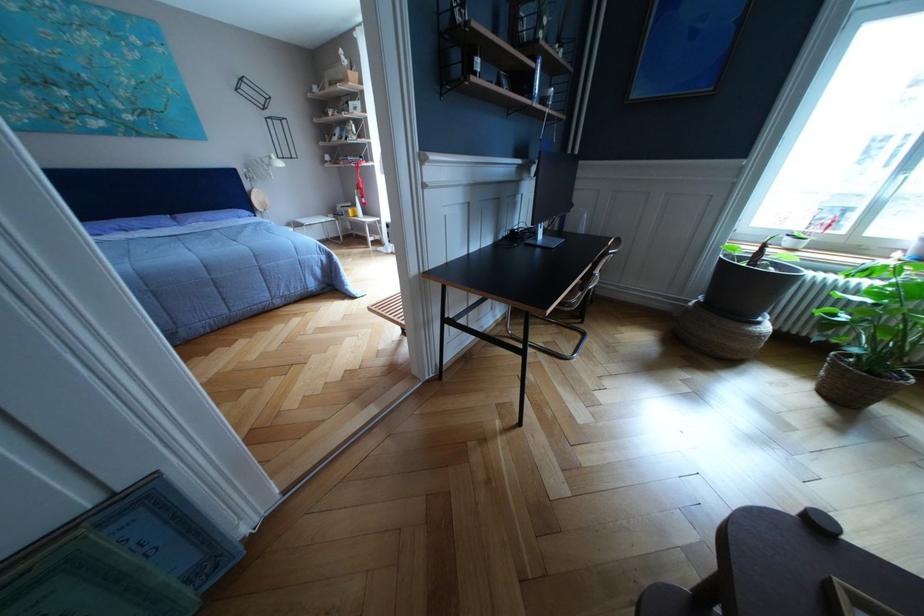
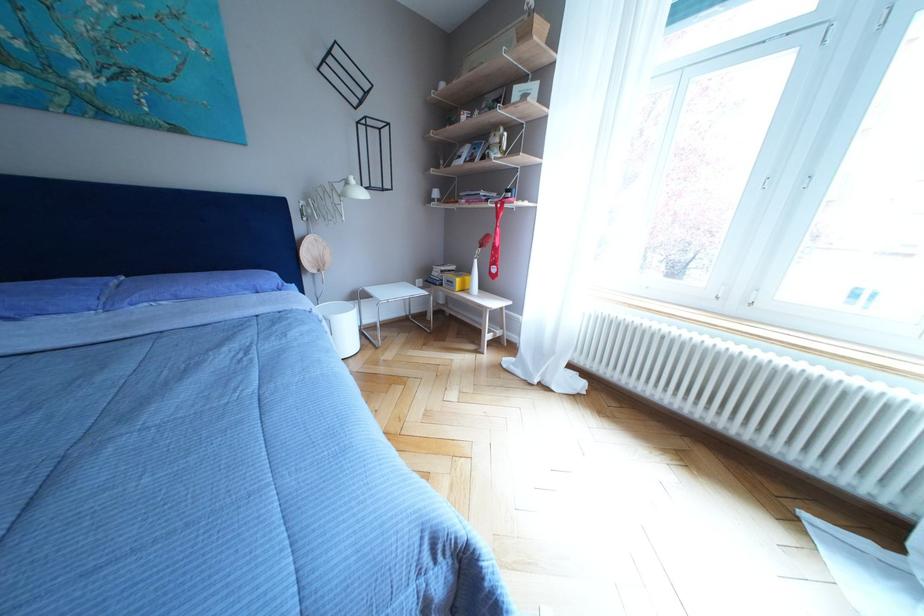
The point at (363, 211) is marked in the first image. Where is the corresponding point in the second image?

(473, 276)